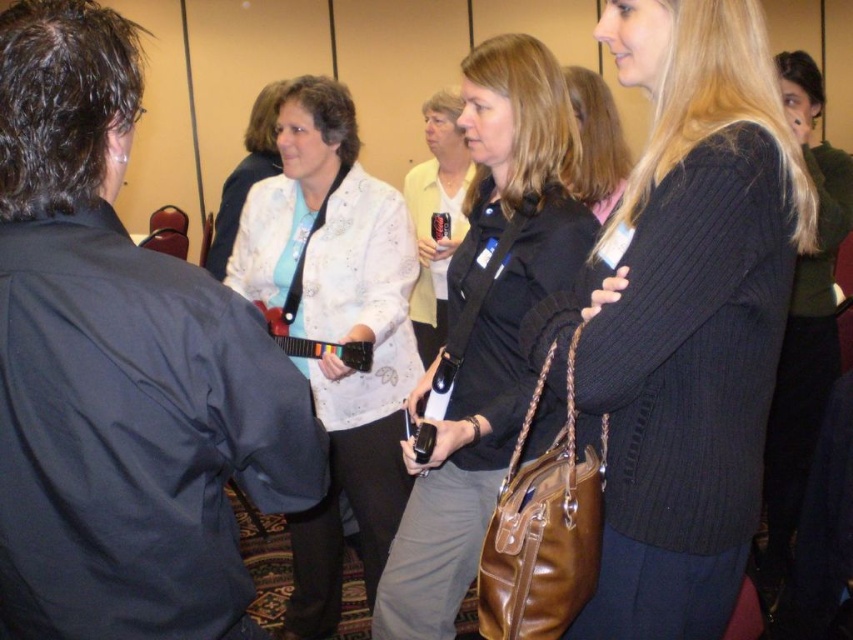
What is located at the coordinates point (335, 330)?

The white textured blouse at center is located at point (335, 330).